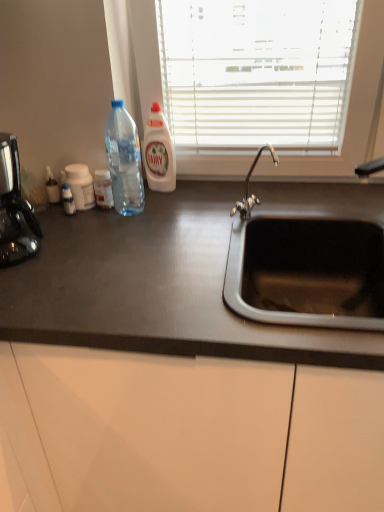
Where is `free spot to the right of transparent plastic bottle at left, the 3th bottle viewed from the left`? free spot to the right of transparent plastic bottle at left, the 3th bottle viewed from the left is located at coordinates (182, 209).